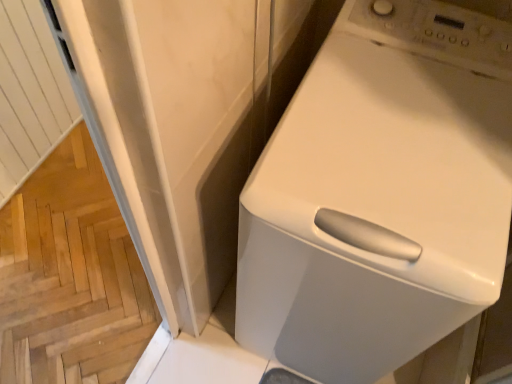
Question: Does white glossy washing machine at upper right have a smaller size compared to wooden parquet floor at lower left?

Choices:
 (A) no
 (B) yes

Answer: (A)

Question: Is white glossy washing machine at upper right to the right of wooden parquet floor at lower left from the viewer's perspective?

Choices:
 (A) no
 (B) yes

Answer: (B)

Question: Is white glossy washing machine at upper right in front of wooden parquet floor at lower left?

Choices:
 (A) yes
 (B) no

Answer: (A)

Question: Is white glossy washing machine at upper right directly adjacent to wooden parquet floor at lower left?

Choices:
 (A) no
 (B) yes

Answer: (A)

Question: Is white glossy washing machine at upper right far away from wooden parquet floor at lower left?

Choices:
 (A) yes
 (B) no

Answer: (B)

Question: Can you confirm if white glossy washing machine at upper right is thinner than wooden parquet floor at lower left?

Choices:
 (A) yes
 (B) no

Answer: (A)

Question: Does wooden parquet floor at lower left have a greater height compared to white glossy washing machine at upper right?

Choices:
 (A) yes
 (B) no

Answer: (B)

Question: From the image's perspective, is wooden parquet floor at lower left over white glossy washing machine at upper right?

Choices:
 (A) no
 (B) yes

Answer: (A)

Question: Can you confirm if wooden parquet floor at lower left is bigger than white glossy washing machine at upper right?

Choices:
 (A) no
 (B) yes

Answer: (A)

Question: Is wooden parquet floor at lower left positioned beyond the bounds of white glossy washing machine at upper right?

Choices:
 (A) yes
 (B) no

Answer: (A)

Question: Is wooden parquet floor at lower left facing away from white glossy washing machine at upper right?

Choices:
 (A) no
 (B) yes

Answer: (A)

Question: Does wooden parquet floor at lower left lie in front of white glossy washing machine at upper right?

Choices:
 (A) yes
 (B) no

Answer: (B)

Question: From the image's perspective, is wooden parquet floor at lower left located above or below white glossy washing machine at upper right?

Choices:
 (A) below
 (B) above

Answer: (A)